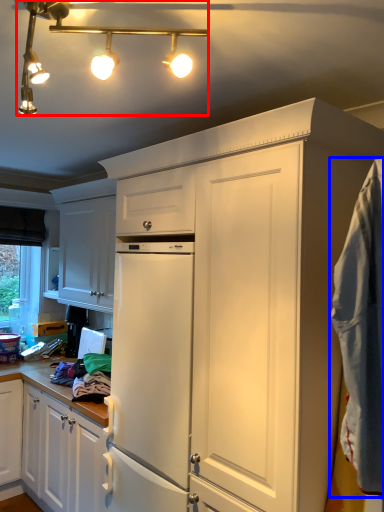
Question: Which object appears closest to the camera in this image, light fixture (highlighted by a red box) or blanket (highlighted by a blue box)?

Choices:
 (A) light fixture
 (B) blanket

Answer: (A)